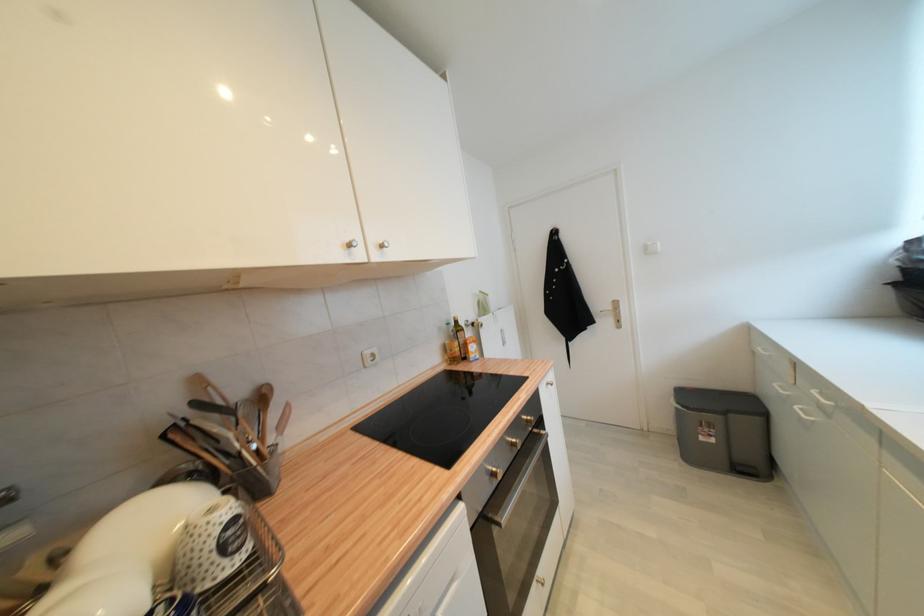
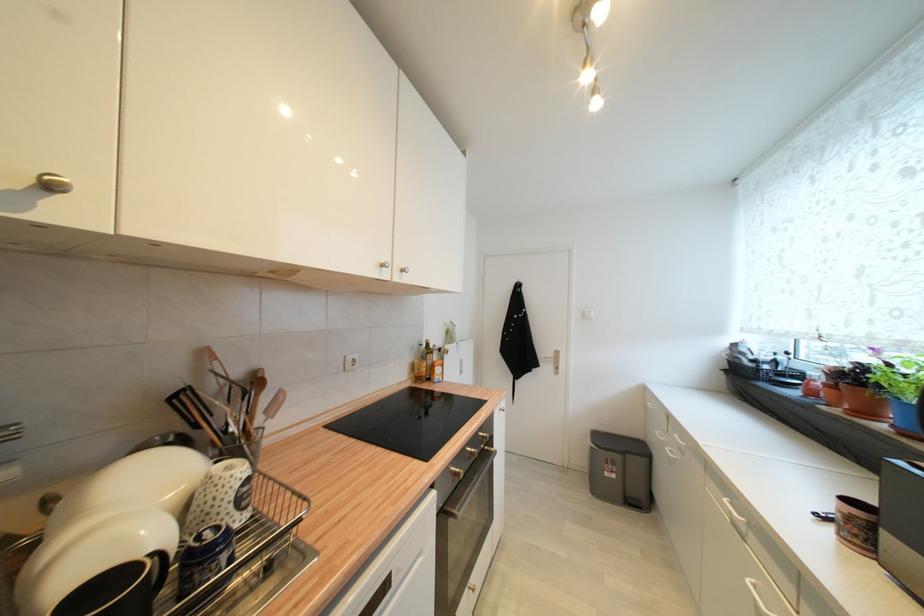
Question: The first image is from the beginning of the video and the second image is from the end. How did the camera likely rotate when shooting the video?

Choices:
 (A) Left
 (B) Right
 (C) Up
 (D) Down

Answer: (B)